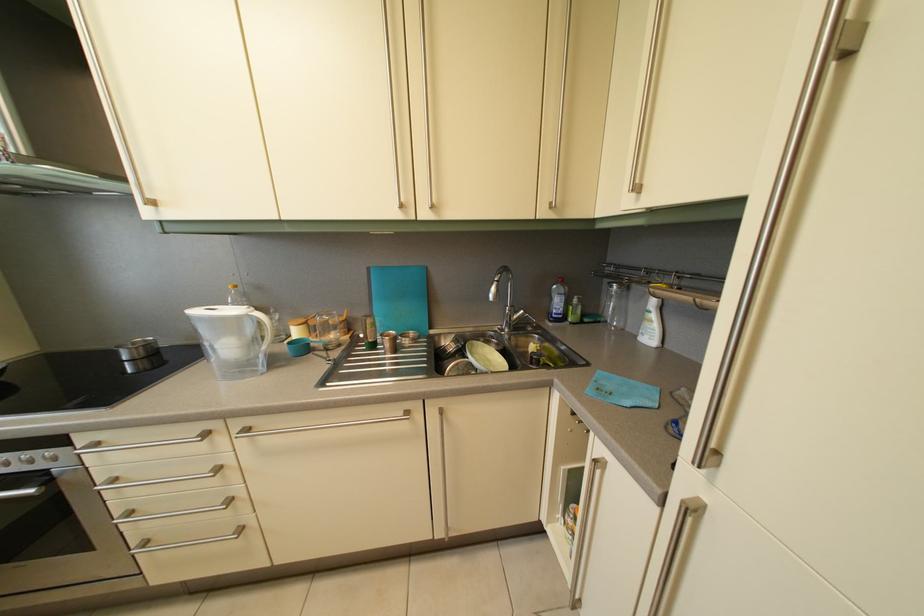
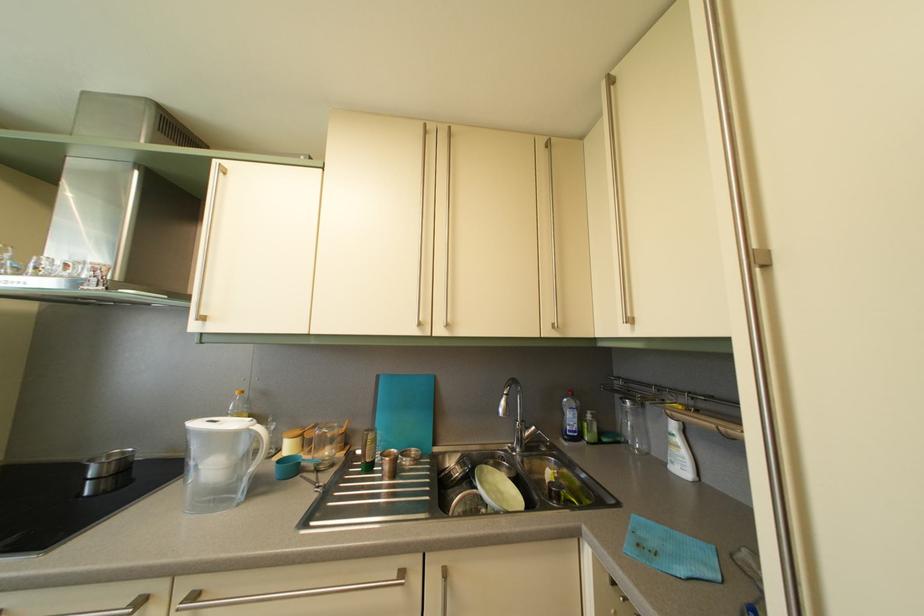
In the second image, find the point that corresponds to pixel 564 322 in the first image.

(578, 439)